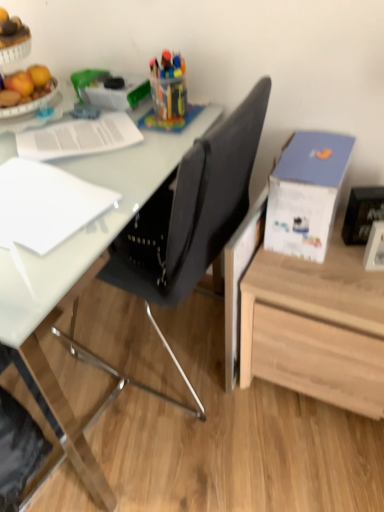
Question: Can you confirm if black glossy picture frame at upper right, which is the 2th picture frame in bottom-to-top order, is taller than white glossy picture frame at lower right, which is the 1th picture frame in bottom-to-top order?

Choices:
 (A) no
 (B) yes

Answer: (B)

Question: Is black glossy picture frame at upper right, which is the 2th picture frame in bottom-to-top order, wider than white glossy picture frame at lower right, which is the 1th picture frame in bottom-to-top order?

Choices:
 (A) no
 (B) yes

Answer: (B)

Question: Is white glossy picture frame at lower right, positioned as the 2th picture frame in top-to-bottom order, completely or partially inside black glossy picture frame at upper right, the first picture frame viewed from the top?

Choices:
 (A) no
 (B) yes

Answer: (A)

Question: Is black glossy picture frame at upper right, the first picture frame viewed from the top, not within white glossy picture frame at lower right, which is the 1th picture frame in bottom-to-top order?

Choices:
 (A) yes
 (B) no

Answer: (A)

Question: Is black glossy picture frame at upper right, which is the 2th picture frame in bottom-to-top order, smaller than white glossy picture frame at lower right, which is the 1th picture frame in bottom-to-top order?

Choices:
 (A) yes
 (B) no

Answer: (B)

Question: Could you tell me if black glossy picture frame at upper right, which is the 2th picture frame in bottom-to-top order, is facing white glossy picture frame at lower right, positioned as the 2th picture frame in top-to-bottom order?

Choices:
 (A) no
 (B) yes

Answer: (B)

Question: Is blue cardboard box at upper right at the back of white paper at left, which appears as the first notebook when viewed from the front?

Choices:
 (A) yes
 (B) no

Answer: (B)

Question: Can you confirm if white paper at left, which is the first notebook in bottom-to-top order, is positioned to the right of blue cardboard box at upper right?

Choices:
 (A) yes
 (B) no

Answer: (B)

Question: Could you tell me if white paper at left, which appears as the first notebook when viewed from the front, is turned towards blue cardboard box at upper right?

Choices:
 (A) yes
 (B) no

Answer: (B)

Question: From a real-world perspective, is white paper at left, acting as the second notebook starting from the top, over blue cardboard box at upper right?

Choices:
 (A) no
 (B) yes

Answer: (B)

Question: Considering the relative sizes of white paper at left, which ranks as the second notebook in back-to-front order, and blue cardboard box at upper right in the image provided, is white paper at left, which ranks as the second notebook in back-to-front order, bigger than blue cardboard box at upper right?

Choices:
 (A) yes
 (B) no

Answer: (B)

Question: Does white paper at left, which ranks as the second notebook in back-to-front order, come behind blue cardboard box at upper right?

Choices:
 (A) yes
 (B) no

Answer: (B)

Question: Is white glossy picture frame at lower right, which is the 1th picture frame in bottom-to-top order, to the left of white paper at upper left, placed as the 2th notebook when sorted from bottom to top, from the viewer's perspective?

Choices:
 (A) no
 (B) yes

Answer: (A)